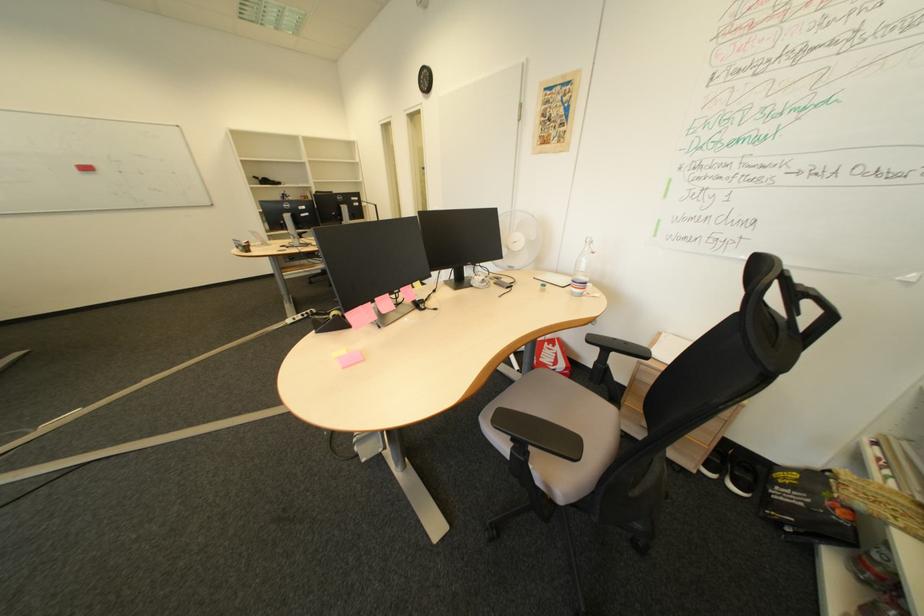
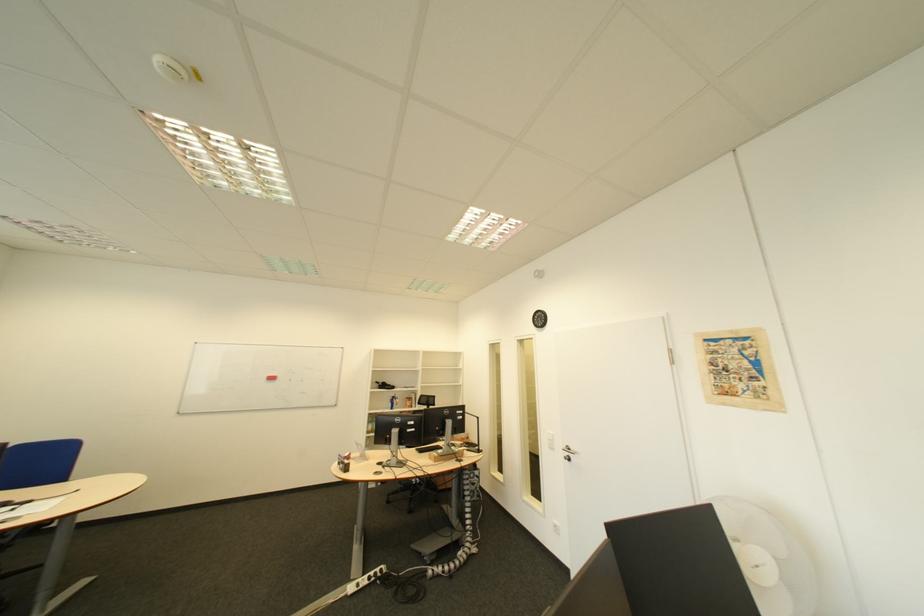
Locate, in the second image, the point that corresponds to point (528, 244) in the first image.

(771, 567)